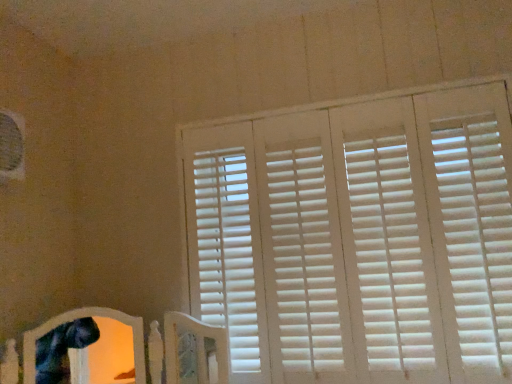
The width and height of the screenshot is (512, 384). What do you see at coordinates (357, 238) in the screenshot?
I see `white matte blinds at upper right` at bounding box center [357, 238].

At what (x,y) coordinates should I click in order to perform the action: click on white matte blinds at upper right. Please return your answer as a coordinate pair (x, y). This screenshot has width=512, height=384. Looking at the image, I should click on (357, 238).

Measure the distance between point (202, 347) and camera.

The distance of point (202, 347) from camera is 1.41 meters.

Image resolution: width=512 pixels, height=384 pixels. In order to click on white wood bed frame at lower left in this screenshot , I will do `click(85, 348)`.

What do you see at coordinates (85, 348) in the screenshot? I see `white wood bed frame at lower left` at bounding box center [85, 348].

Where is `white matte blinds at upper right`? The width and height of the screenshot is (512, 384). white matte blinds at upper right is located at coordinates (357, 238).

Considering the positions of objects white matte blinds at upper right and white wood bed frame at lower left in the image provided, who is more to the right, white matte blinds at upper right or white wood bed frame at lower left?

Positioned to the right is white matte blinds at upper right.

Between white matte blinds at upper right and white wood bed frame at lower left, which one is positioned behind?

white matte blinds at upper right.

Is point (368, 193) more distant than point (138, 355)?

Yes, point (368, 193) is farther from viewer.

From the image's perspective, is white matte blinds at upper right positioned above or below white wood bed frame at lower left?

From the image's perspective, white matte blinds at upper right appears above white wood bed frame at lower left.

From a real-world perspective, does white matte blinds at upper right stand above white wood bed frame at lower left?

Yes, from a real-world perspective, white matte blinds at upper right is above white wood bed frame at lower left.

Can you confirm if white matte blinds at upper right is wider than white wood bed frame at lower left?

No.

Is white matte blinds at upper right taller or shorter than white wood bed frame at lower left?

Considering their sizes, white matte blinds at upper right has more height than white wood bed frame at lower left.

Which of these two, white matte blinds at upper right or white wood bed frame at lower left, is bigger?

With larger size is white matte blinds at upper right.

Is white wood bed frame at lower left inside white matte blinds at upper right?

Answer: No, white wood bed frame at lower left is not inside white matte blinds at upper right.

Is there a large distance between white matte blinds at upper right and white wood bed frame at lower left?

white matte blinds at upper right is actually quite close to white wood bed frame at lower left.

Is white matte blinds at upper right aimed at white wood bed frame at lower left?

Yes, white matte blinds at upper right is aimed at white wood bed frame at lower left.

What's the angular difference between white matte blinds at upper right and white wood bed frame at lower left's facing directions?

white matte blinds at upper right and white wood bed frame at lower left are facing 37.3 degrees away from each other.

Measure the distance between white matte blinds at upper right and white wood bed frame at lower left.

white matte blinds at upper right is 48.75 centimeters away from white wood bed frame at lower left.

Find the location of a particular element. This screenshot has height=384, width=512. bed frame located in front of the white matte blinds at upper right is located at coordinates (85, 348).

Which object is positioned more to the right, white wood bed frame at lower left or white matte blinds at upper right?

white matte blinds at upper right is more to the right.

Relative to white matte blinds at upper right, is white wood bed frame at lower left in front or behind?

In the image, white wood bed frame at lower left appears in front of white matte blinds at upper right.

Is point (115, 345) closer or farther from the camera than point (236, 160)?

Point (115, 345).

From the image's perspective, relative to white matte blinds at upper right, is white wood bed frame at lower left above or below?

white wood bed frame at lower left is below white matte blinds at upper right.

From a real-world perspective, which object stands above the other?

From a 3D spatial view, white matte blinds at upper right is above.

Considering the relative sizes of white wood bed frame at lower left and white matte blinds at upper right in the image provided, is white wood bed frame at lower left thinner than white matte blinds at upper right?

Incorrect, the width of white wood bed frame at lower left is not less than that of white matte blinds at upper right.

Who is shorter, white wood bed frame at lower left or white matte blinds at upper right?

white wood bed frame at lower left is shorter.

Looking at the image, does white wood bed frame at lower left seem bigger or smaller compared to white matte blinds at upper right?

In the image, white wood bed frame at lower left appears to be smaller than white matte blinds at upper right.

Would you say white matte blinds at upper right is part of white wood bed frame at lower left's contents?

No, white wood bed frame at lower left does not contain white matte blinds at upper right.

Is the surface of white wood bed frame at lower left in direct contact with white matte blinds at upper right?

No, white wood bed frame at lower left is not in contact with white matte blinds at upper right.

Is white matte blinds at upper right at the back of white wood bed frame at lower left?

No, white wood bed frame at lower left is not facing the opposite direction of white matte blinds at upper right.

What's the angular difference between white wood bed frame at lower left and white matte blinds at upper right's facing directions?

37.3 degrees separate the facing orientations of white wood bed frame at lower left and white matte blinds at upper right.

You are a GUI agent. You are given a task and a screenshot of the screen. Output one action in this format:
    pyautogui.click(x=<x>, y=<y>)
    Task: Click on the window blind lying on the right of white wood bed frame at lower left
    This screenshot has height=384, width=512.
    Given the screenshot: What is the action you would take?
    pyautogui.click(x=357, y=238)

Where is `window blind on the right of white wood bed frame at lower left`? This screenshot has height=384, width=512. window blind on the right of white wood bed frame at lower left is located at coordinates (357, 238).

At what (x,y) coordinates should I click in order to perform the action: click on bed frame located underneath the white matte blinds at upper right (from a real-world perspective). Please return your answer as a coordinate pair (x, y). The width and height of the screenshot is (512, 384). Looking at the image, I should click on (85, 348).